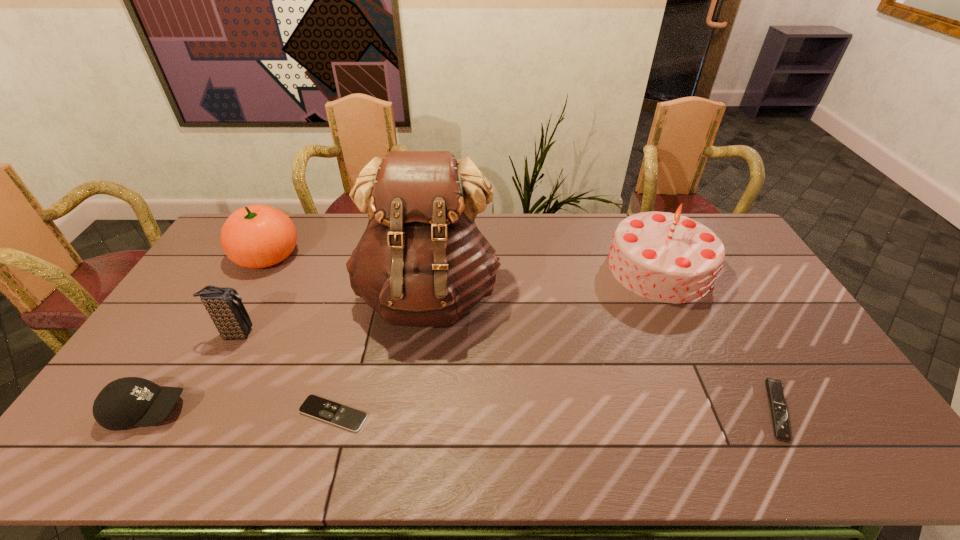
Choose which object is the nearest neighbor to the pumpkin. Please provide its 2D coordinates. Your answer should be formatted as a tuple, i.e. [(x, y)], where the tuple contains the x and y coordinates of a point satisfying the conditions above.

[(225, 307)]

Locate an element on the screen. vacant space that satisfies the following two spatial constraints: 1. on the front side of the pumpkin; 2. on the front-facing side of the fifth tallest object is located at coordinates (179, 410).

Locate an element on the screen. Image resolution: width=960 pixels, height=540 pixels. free space that satisfies the following two spatial constraints: 1. on the front side of the pumpkin; 2. on the right side of the sixth shortest object is located at coordinates (259, 268).

Find the location of a particular element. free space that satisfies the following two spatial constraints: 1. on the front side of the birthday cake; 2. with the zip open on the clutch bag is located at coordinates (690, 334).

You are a GUI agent. You are given a task and a screenshot of the screen. Output one action in this format:
    pyautogui.click(x=<x>, y=<y>)
    Task: Click on the free space in the image that satisfies the following two spatial constraints: 1. on the front side of the birthday cake; 2. with the zip open on the clutch bag
    
    Given the screenshot: What is the action you would take?
    pyautogui.click(x=690, y=334)

The image size is (960, 540). Find the location of `vacant space that satisfies the following two spatial constraints: 1. at the front of the taller remote control with buckles; 2. on the right side of the tallest object`. vacant space that satisfies the following two spatial constraints: 1. at the front of the taller remote control with buckles; 2. on the right side of the tallest object is located at coordinates (414, 410).

Identify the location of vacant region that satisfies the following two spatial constraints: 1. on the front side of the shortest object; 2. on the right side of the pumpkin. Image resolution: width=960 pixels, height=540 pixels. (177, 414).

Where is `free space that satisfies the following two spatial constraints: 1. at the front of the sixth tallest object with buckles; 2. on the left side of the tallest object`? free space that satisfies the following two spatial constraints: 1. at the front of the sixth tallest object with buckles; 2. on the left side of the tallest object is located at coordinates (414, 410).